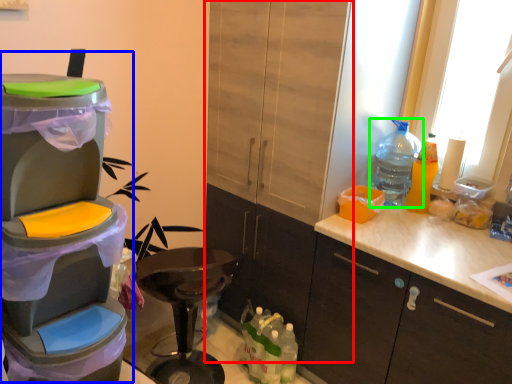
Question: Which object is positioned farthest from cabinetry (highlighted by a red box)? Select from appliance (highlighted by a blue box) and bottle (highlighted by a green box).

Choices:
 (A) appliance
 (B) bottle

Answer: (A)